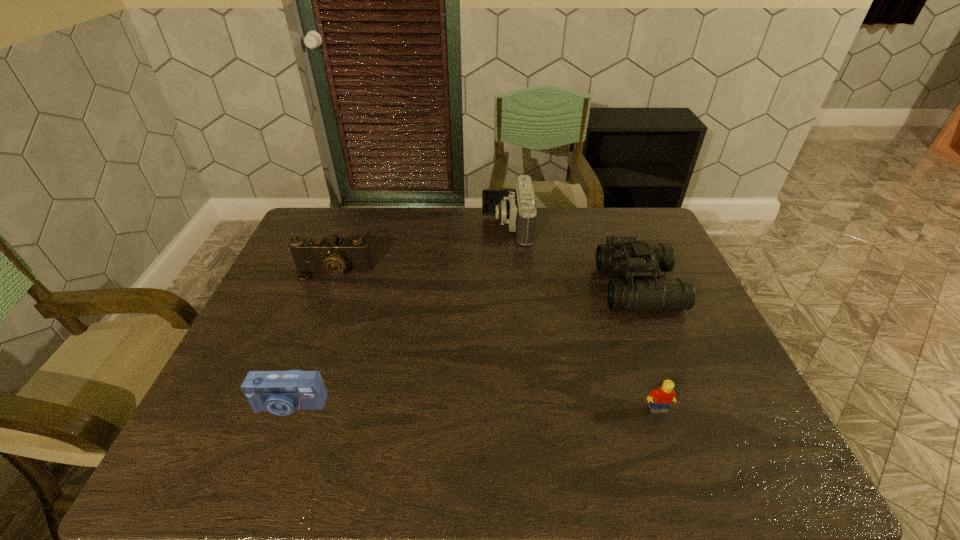
This screenshot has height=540, width=960. Find the location of `free space at the far right corner`. free space at the far right corner is located at coordinates (612, 219).

At what (x,y) coordinates should I click in order to perform the action: click on vacant space that is in between the Lego and the nearest camera. Please return your answer as a coordinate pair (x, y). The width and height of the screenshot is (960, 540). Looking at the image, I should click on (473, 407).

At what (x,y) coordinates should I click in order to perform the action: click on empty space that is in between the Lego and the nearest camera. Please return your answer as a coordinate pair (x, y). Image resolution: width=960 pixels, height=540 pixels. Looking at the image, I should click on (473, 407).

You are a GUI agent. You are given a task and a screenshot of the screen. Output one action in this format:
    pyautogui.click(x=<x>, y=<y>)
    Task: Click on the free spot between the Lego and the binoculars
    This screenshot has height=540, width=960.
    Given the screenshot: What is the action you would take?
    pyautogui.click(x=648, y=348)

Locate an element on the screen. This screenshot has width=960, height=540. free space between the nearest camera and the Lego is located at coordinates (473, 407).

At what (x,y) coordinates should I click in order to perform the action: click on empty space between the second nearest camera and the binoculars. Please return your answer as a coordinate pair (x, y). This screenshot has width=960, height=540. Looking at the image, I should click on (486, 280).

Find the location of a particular element. unoccupied area between the second nearest camera and the tallest camera is located at coordinates (420, 249).

The height and width of the screenshot is (540, 960). I want to click on free space between the binoculars and the second tallest camera, so click(486, 280).

Locate an element on the screen. The width and height of the screenshot is (960, 540). free space between the shortest camera and the second farthest camera is located at coordinates pos(312,338).

In order to click on vacant point located between the second nearest camera and the binoculars in this screenshot , I will do click(486, 280).